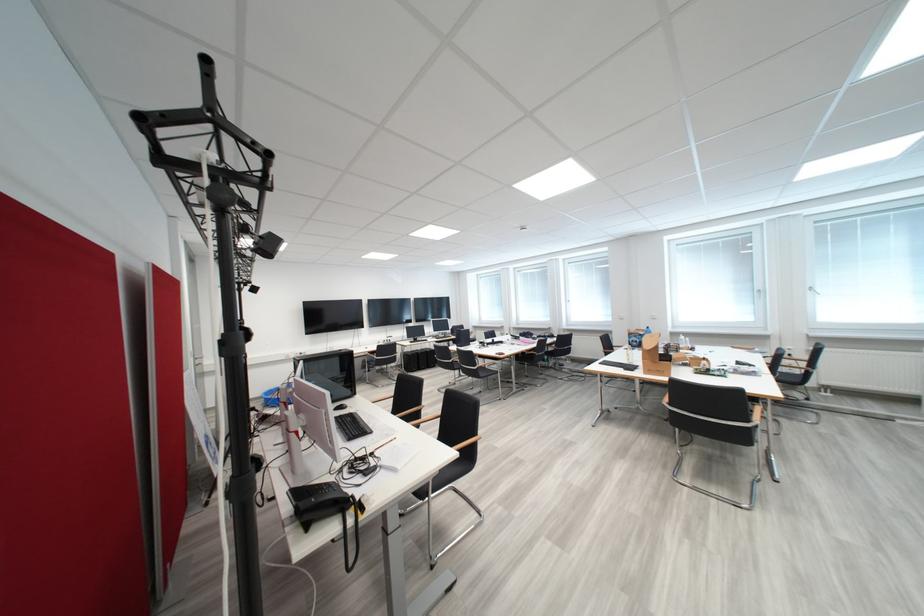
You are a GUI agent. You are given a task and a screenshot of the screen. Output one action in this format:
    pyautogui.click(x=<x>, y=<y>)
    Task: Click on the wooden chair armrest
    This screenshot has width=924, height=616.
    Given the screenshot: What is the action you would take?
    pyautogui.click(x=467, y=442)